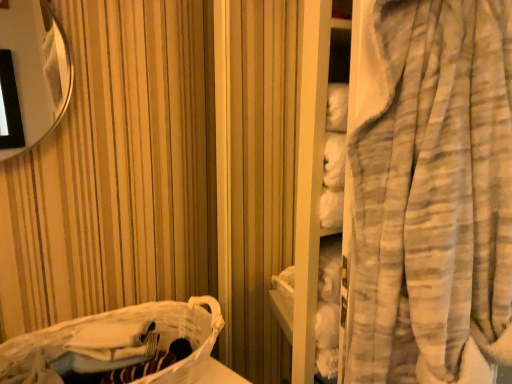
You are a GUI agent. You are given a task and a screenshot of the screen. Output one action in this format:
    pyautogui.click(x=<x>, y=<y>)
    Task: Click on the white fabric basket at lower left
    This screenshot has height=384, width=512.
    Given the screenshot: What is the action you would take?
    pyautogui.click(x=120, y=320)

What do you see at coordinates (120, 320) in the screenshot? I see `white fabric basket at lower left` at bounding box center [120, 320].

I want to click on white fabric basket at lower left, so click(x=120, y=320).